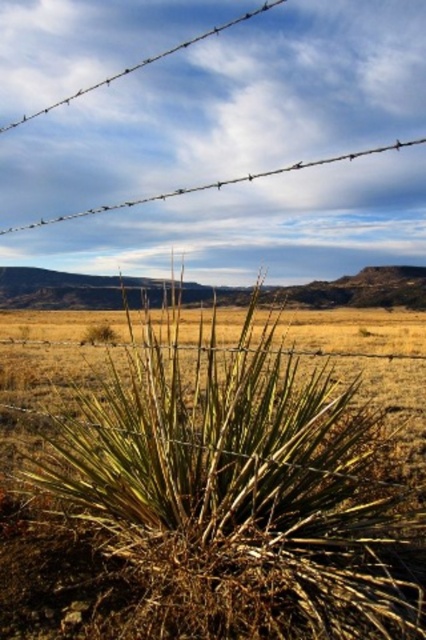
Does brown dry grass at center have a greater width compared to wire at upper center?

No, brown dry grass at center is not wider than wire at upper center.

Is brown dry grass at center thinner than wire at upper center?

Yes.

Between point (282, 563) and point (393, 145), which one is positioned in front?

Point (282, 563) is in front.

You are a GUI agent. You are given a task and a screenshot of the screen. Output one action in this format:
    pyautogui.click(x=<x>, y=<y>)
    Task: Click on the brown dry grass at center
    This screenshot has width=426, height=640.
    Given the screenshot: What is the action you would take?
    pyautogui.click(x=236, y=486)